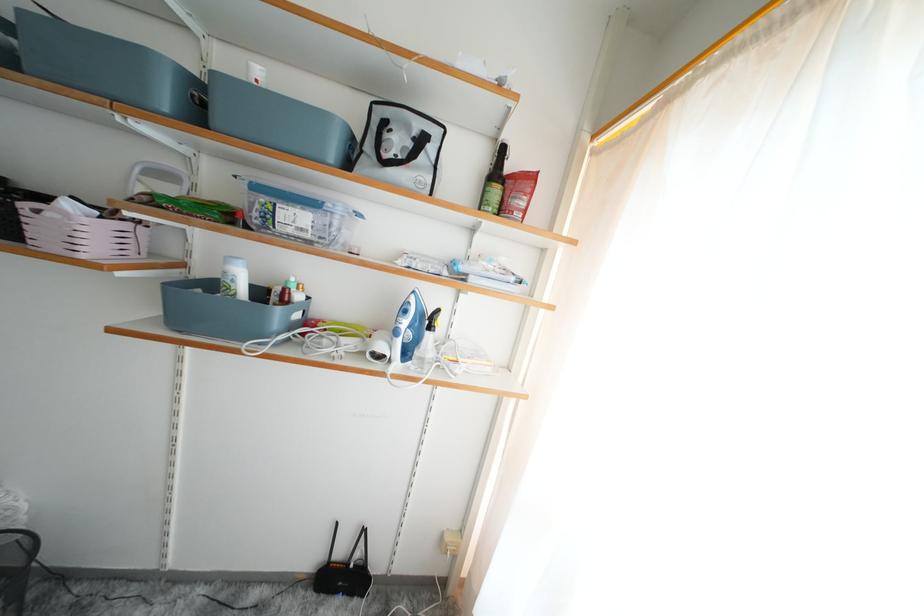
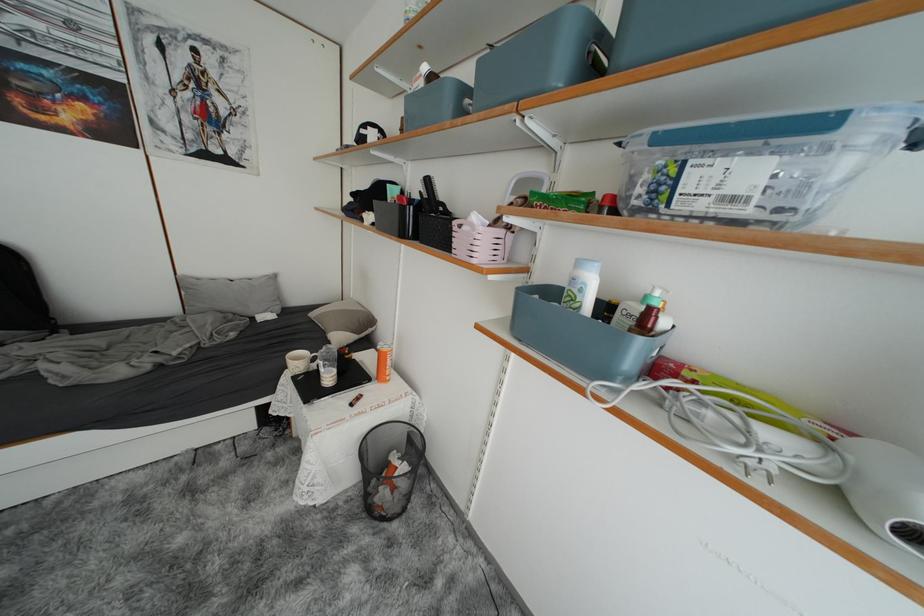
Find the pixel in the second image that matches point (126, 123) in the first image.

(525, 127)